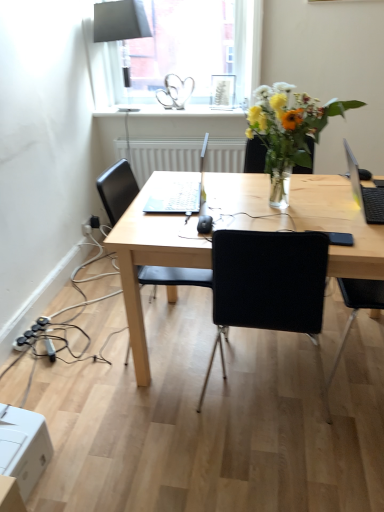
Image resolution: width=384 pixels, height=512 pixels. Identify the location of translucent glass vase at upper right. 288,131.

What do you see at coordinates (179, 193) in the screenshot?
I see `sleek silver laptop at center` at bounding box center [179, 193].

Find the location of a particular element. white glossy window sill at upper center is located at coordinates (168, 111).

Image resolution: width=384 pixels, height=512 pixels. Describe the element at coordinates (300, 216) in the screenshot. I see `light wood desk at center` at that location.

Locate an element on the screen. matte black lampshade at upper center is located at coordinates (120, 26).

Find the location of a particular element. white cardboard box at lower left is located at coordinates (23, 446).

Locate an element on the screen. The image size is (384, 512). translucent glass vase at upper right is located at coordinates (288, 131).

Does light wood desk at center turn towards white glossy window sill at upper center?

No, light wood desk at center does not turn towards white glossy window sill at upper center.

From a real-world perspective, is light wood desk at center physically above white glossy window sill at upper center?

Actually, light wood desk at center is physically below white glossy window sill at upper center in the real world.

Looking at this image, which of these two, light wood desk at center or white glossy window sill at upper center, is bigger?

light wood desk at center is bigger.

Is light wood desk at center spatially inside white glossy window sill at upper center, or outside of it?

light wood desk at center is spatially situated outside white glossy window sill at upper center.

Is black plastic chair at center completely or partially inside white cardboard box at lower left?

No, black plastic chair at center is not a part of white cardboard box at lower left.

Between white cardboard box at lower left and black plastic chair at center, which one has larger width?

Wider between the two is black plastic chair at center.

Between point (20, 432) and point (129, 178), which one is positioned behind?

Point (129, 178)

From the image's perspective, which one is positioned lower, black plastic power plugs and sockets at lower left or white glossy window sill at upper center?

black plastic power plugs and sockets at lower left, from the image's perspective.

Considering the relative sizes of black plastic power plugs and sockets at lower left and white glossy window sill at upper center in the image provided, is black plastic power plugs and sockets at lower left thinner than white glossy window sill at upper center?

Yes, black plastic power plugs and sockets at lower left is thinner than white glossy window sill at upper center.

Is white glossy window sill at upper center at the back of black plastic power plugs and sockets at lower left?

black plastic power plugs and sockets at lower left does not have its back to white glossy window sill at upper center.

Could white glossy window sill at upper center be considered to be inside black plastic power plugs and sockets at lower left?

No, white glossy window sill at upper center is located outside of black plastic power plugs and sockets at lower left.

How distant is black plastic mouse at center from black plastic chair at center?

A distance of 31.95 inches exists between black plastic mouse at center and black plastic chair at center.

Looking at this image, considering the positions of objects black plastic mouse at center and black plastic chair at center in the image provided, who is more to the right, black plastic mouse at center or black plastic chair at center?

black plastic mouse at center is more to the right.

Is there a large distance between black plastic mouse at center and black plastic chair at center?

No.

Is black plastic mouse at center located outside black plastic chair at center?

No.

Image resolution: width=384 pixels, height=512 pixels. Find the location of `tableware below the sleek silver laptop at center (from the image's perspective)`. tableware below the sleek silver laptop at center (from the image's perspective) is located at coordinates (204, 224).

Looking at their sizes, would you say black plastic mouse at center is wider or thinner than sleek silver laptop at center?

black plastic mouse at center is thinner than sleek silver laptop at center.

Does black plastic mouse at center have a larger size compared to sleek silver laptop at center?

Incorrect, black plastic mouse at center is not larger than sleek silver laptop at center.

Based on the photo, considering the relative positions of white glossy window sill at upper center and sleek silver laptop at center in the image provided, is white glossy window sill at upper center to the left of sleek silver laptop at center from the viewer's perspective?

Yes.

Is white glossy window sill at upper center located outside sleek silver laptop at center?

Yes.

How far apart are white glossy window sill at upper center and sleek silver laptop at center?

The distance of white glossy window sill at upper center from sleek silver laptop at center is 1.16 meters.

How distant is translucent glass vase at upper right from sleek silver laptop at center?

They are 16.91 inches apart.

I want to click on computer below the translucent glass vase at upper right (from a real-world perspective), so click(x=179, y=193).

Can sleek silver laptop at center be found inside translucent glass vase at upper right?

Definitely not — sleek silver laptop at center is not inside translucent glass vase at upper right.

Locate an element on the screen. The height and width of the screenshot is (512, 384). window sill that is above the light wood desk at center (from the image's perspective) is located at coordinates (168, 111).

Where is `cardboard box in front of the black plastic chair at center`? cardboard box in front of the black plastic chair at center is located at coordinates (23, 446).

Considering their positions, is black plastic mouse at center positioned further to white glossy window sill at upper center than transparent glass window at upper center?

Based on the image, black plastic mouse at center appears to be further to white glossy window sill at upper center.

Which object lies further to the anchor point translucent glass vase at upper right, light wood desk at center or matte black lampshade at upper center?

The object further to translucent glass vase at upper right is matte black lampshade at upper center.

From the image, which object appears to be farther from black plastic chair at center, white glossy window sill at upper center or light wood desk at center?

white glossy window sill at upper center is further to black plastic chair at center.

Estimate the real-world distances between objects in this image. Which object is further from light wood desk at center, black plastic mouse at center or transparent glass window at upper center?

transparent glass window at upper center lies further to light wood desk at center than the other object.

Estimate the real-world distances between objects in this image. Which object is closer to sleek silver laptop at center, matte black lampshade at upper center or black plastic chair at center?

black plastic chair at center is closer to sleek silver laptop at center.

Estimate the real-world distances between objects in this image. Which object is closer to light wood desk at center, black matte laptop at right or transparent glass window at upper center?

The object closer to light wood desk at center is black matte laptop at right.

Looking at the image, which one is located closer to black plastic mouse at center, translucent glass vase at upper right or black plastic power plugs and sockets at lower left?

Based on the image, translucent glass vase at upper right appears to be nearer to black plastic mouse at center.

Based on their spatial positions, is black plastic power plugs and sockets at lower left or matte black lampshade at upper center further from translucent glass vase at upper right?

Based on the image, matte black lampshade at upper center appears to be further to translucent glass vase at upper right.

This screenshot has height=512, width=384. Identify the location of chair between translucent glass vase at upper right and white cardboard box at lower left vertically. (117, 189).

The image size is (384, 512). I want to click on chair between black plastic mouse at center and white cardboard box at lower left vertically, so click(117, 189).

The height and width of the screenshot is (512, 384). I want to click on window sill between transparent glass window at upper center and white cardboard box at lower left in the vertical direction, so click(168, 111).

The width and height of the screenshot is (384, 512). I want to click on computer that lies between matte black lampshade at upper center and black plastic mouse at center from top to bottom, so click(x=179, y=193).